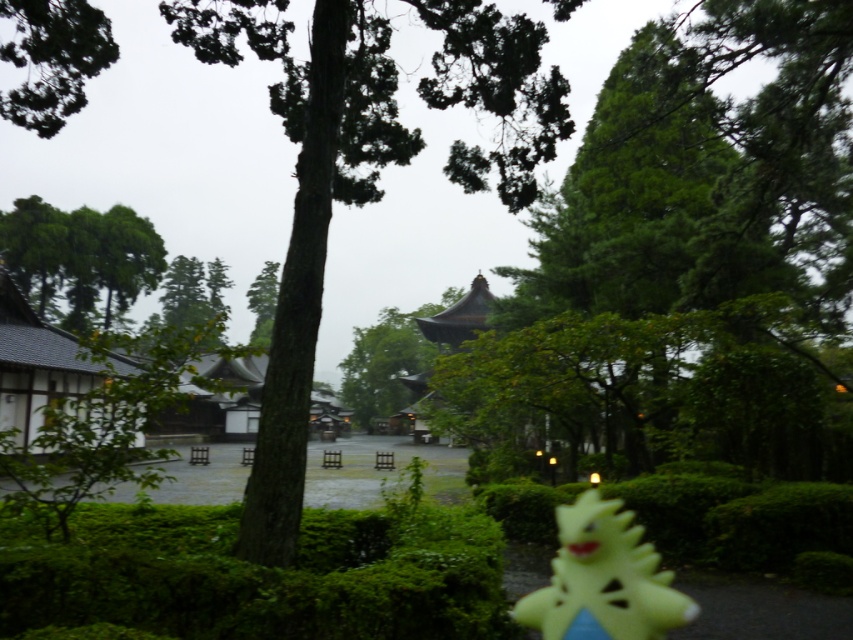
Is green mossy hedge at lower left bigger than yellow rubber duck at lower right?

Yes.

Does green mossy hedge at lower left appear over yellow rubber duck at lower right?

Yes, green mossy hedge at lower left is above yellow rubber duck at lower right.

Does point (204, 545) come farther from viewer compared to point (561, 611)?

Yes, point (204, 545) is farther from viewer.

Identify the location of green mossy hedge at lower left. coord(258,573).

Which of these two, green leafy tree at center or yellow rubber duck at lower right, stands shorter?

With less height is yellow rubber duck at lower right.

Can you confirm if green leafy tree at center is positioned to the right of yellow rubber duck at lower right?

In fact, green leafy tree at center is to the left of yellow rubber duck at lower right.

You are a GUI agent. You are given a task and a screenshot of the screen. Output one action in this format:
    pyautogui.click(x=<x>, y=<y>)
    Task: Click on the green leafy tree at center
    
    Given the screenshot: What is the action you would take?
    pyautogui.click(x=305, y=205)

Which is above, green leafy tree at center or green mossy hedge at lower left?

green leafy tree at center is above.

Which is more to the left, green leafy tree at center or green mossy hedge at lower left?

Positioned to the left is green leafy tree at center.

Where is `green leafy tree at center`? The width and height of the screenshot is (853, 640). green leafy tree at center is located at coordinates (305, 205).

The image size is (853, 640). I want to click on green leafy tree at center, so click(305, 205).